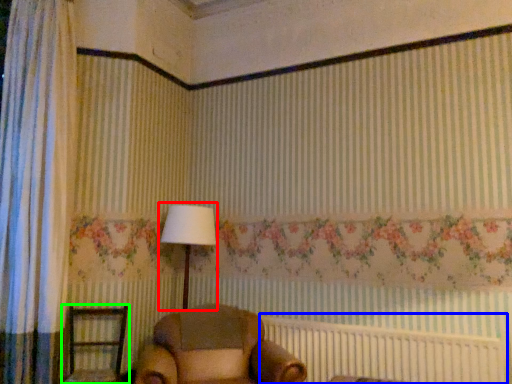
Question: Which object is the closest to the table lamp (highlighted by a red box)? Choose among these: bed frame (highlighted by a blue box) or furniture (highlighted by a green box).

Choices:
 (A) bed frame
 (B) furniture

Answer: (B)